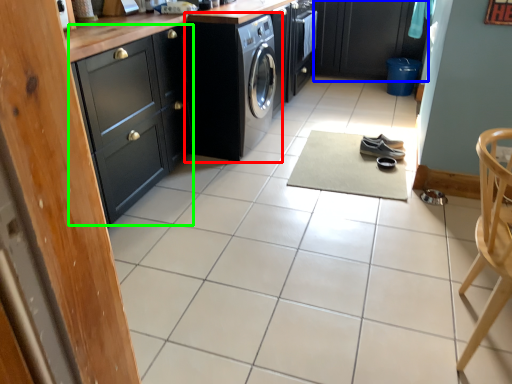
Question: Estimate the real-world distances between objects in this image. Which object is farther from washing machine (highlighted by a red box), cabinetry (highlighted by a blue box) or cabinetry (highlighted by a green box)?

Choices:
 (A) cabinetry
 (B) cabinetry

Answer: (A)